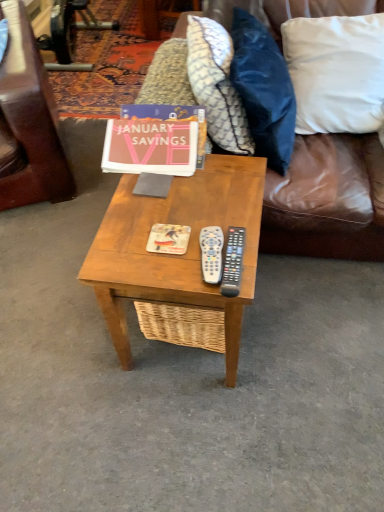
The image size is (384, 512). Find the location of `vacant space in between woodenwoodencoffee table at center and brown leather couch at upper right`. vacant space in between woodenwoodencoffee table at center and brown leather couch at upper right is located at coordinates (310, 311).